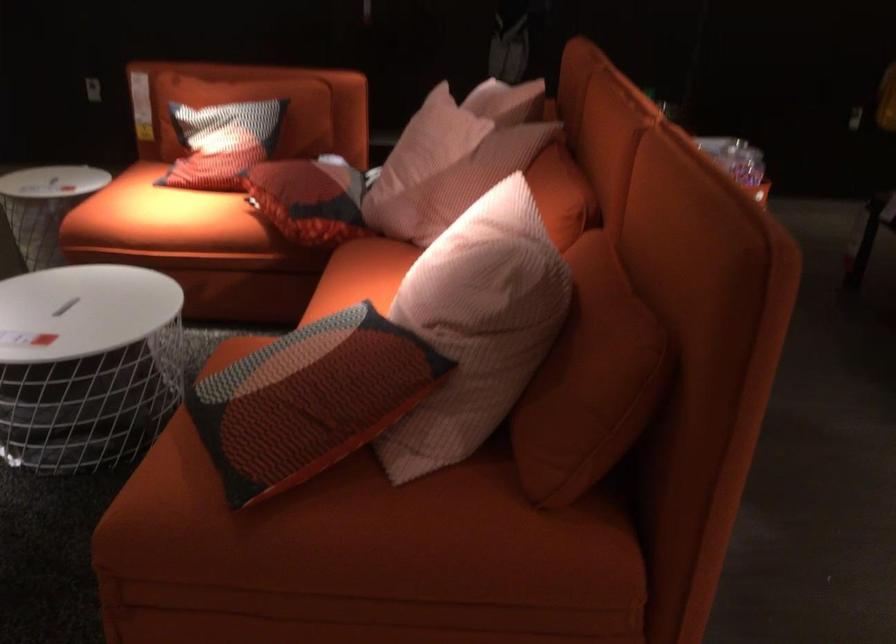
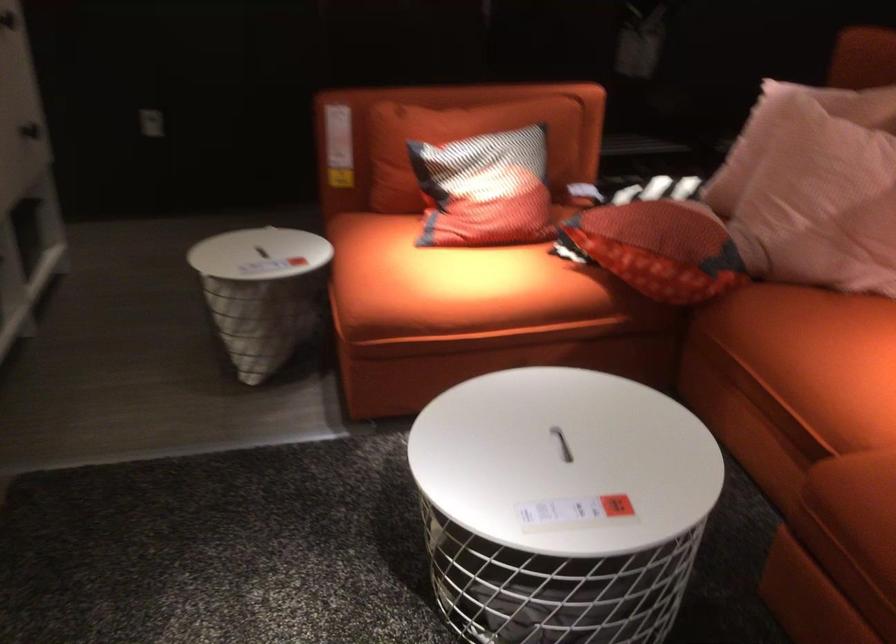
The images are taken continuously from a first-person perspective. In which direction are you moving?

The movement direction of the cameraman is left, forward.